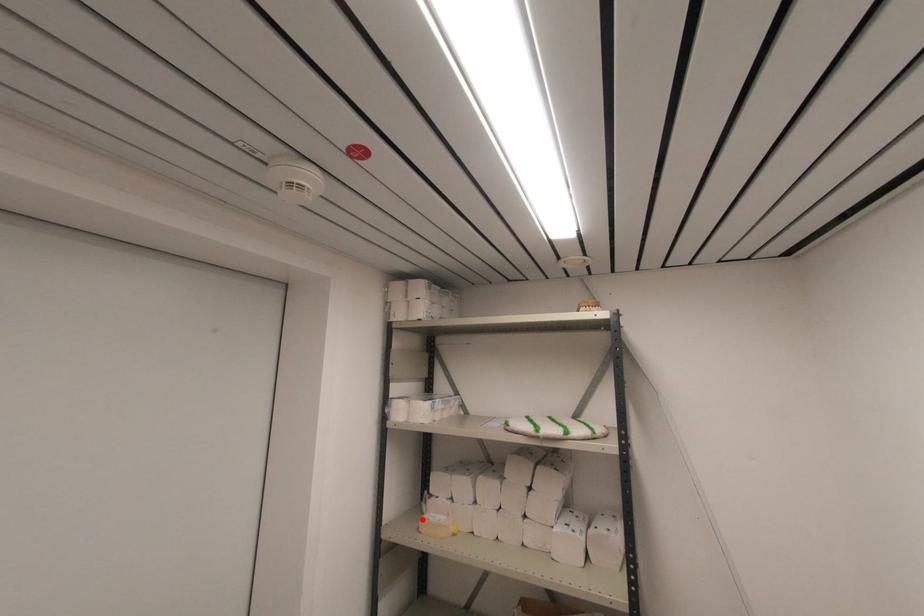
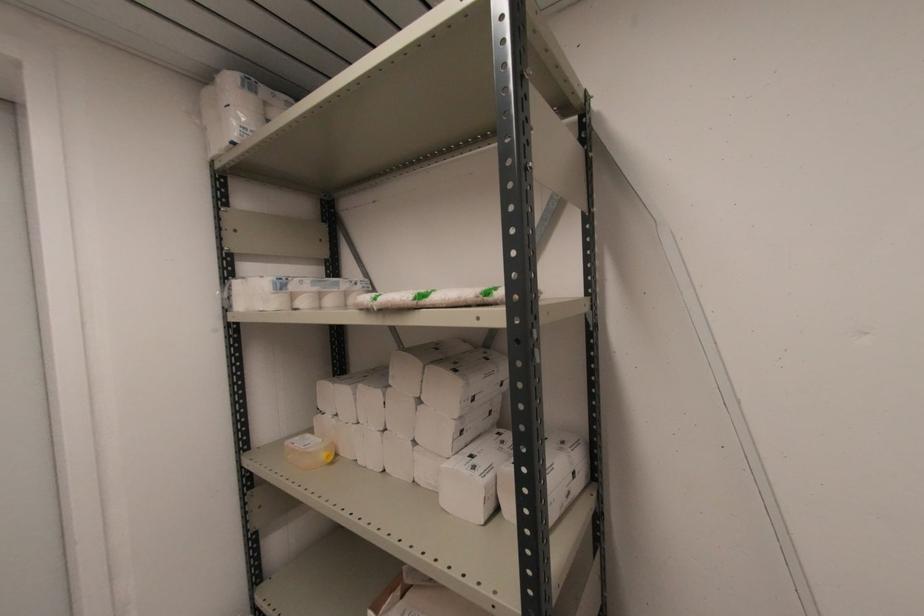
Find the pixel in the second image that matches the highlighted location in the first image.

(289, 442)